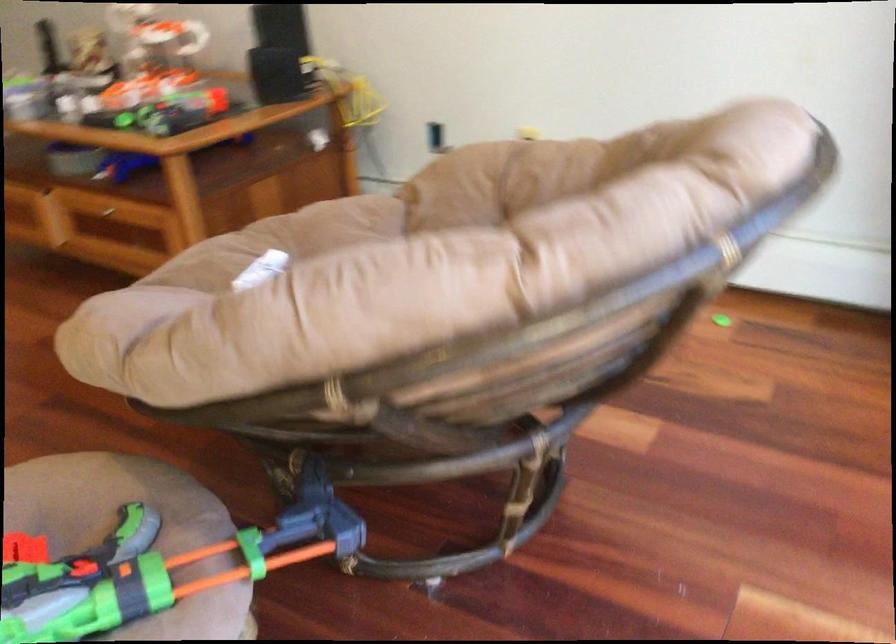
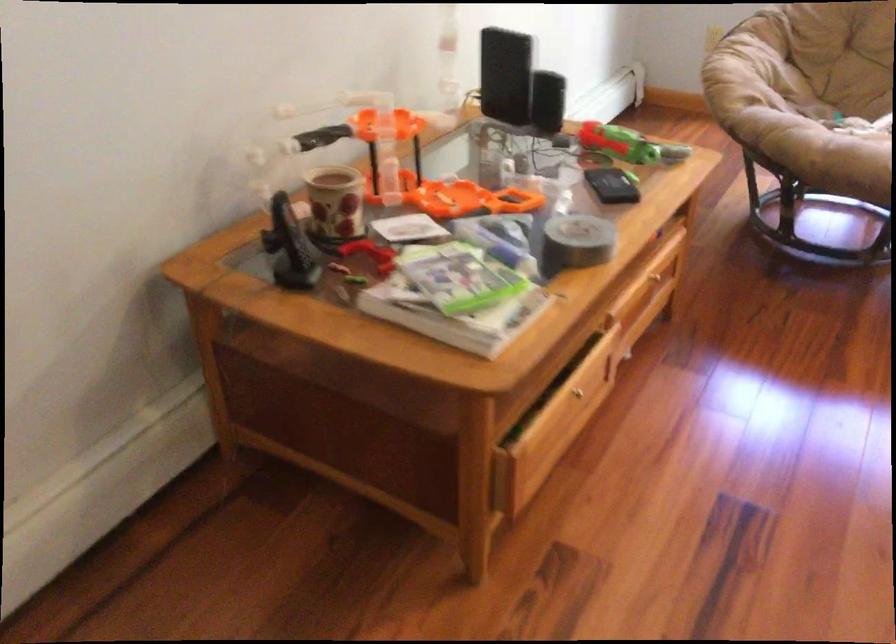
Locate, in the second image, the point that corresponds to pixel 472 176 in the first image.

(745, 69)